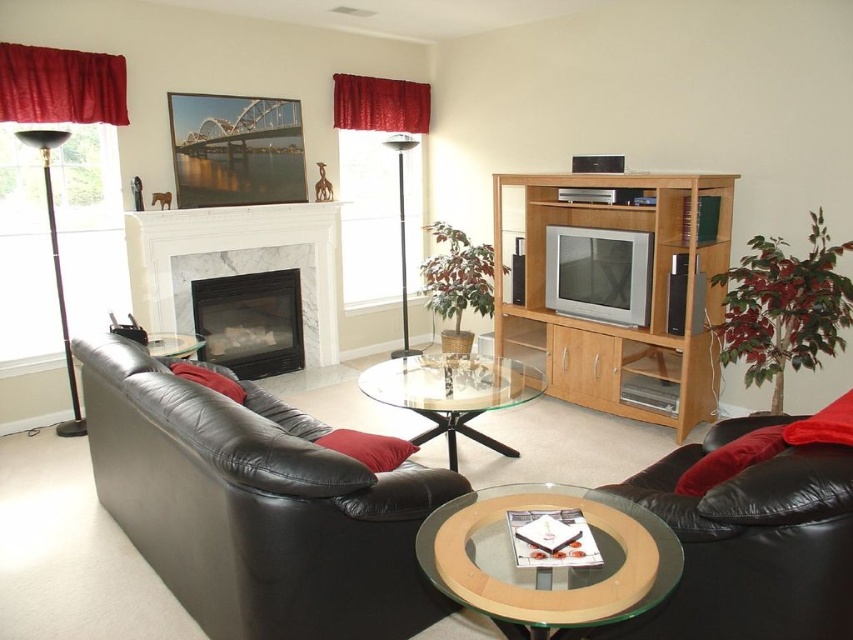
You are planning to rearrange the living room and want to place a new rectangular rug that is the same size as the clear glass coffee table at center. If the black leather couch at lower left is currently occupying space, will the rug fit in the remaining area near the coffee table?

The black leather couch at lower left is larger than the clear glass coffee table at center. Since the rug is the same size as the coffee table, there should be enough space near the coffee table for the rug, as the couch is bigger and likely occupies a different area.

You are standing in the center of the living room and want to sit on the black leather couch at lower left. In which direction should you move to reach it?

You should move to the left from the center of the living room to reach the black leather couch at lower left.

You are planning to place a large rectangular rug in the living room. The rug needs to cover both the black leather couch at lower right and the white marble fireplace at center. Considering their sizes, will the rug need to be larger than the combined length of both objects?

The black leather couch at lower right has a smaller size compared to white marble fireplace at center. Therefore, the rug will need to be larger than the combined length of both objects to cover them both adequately.